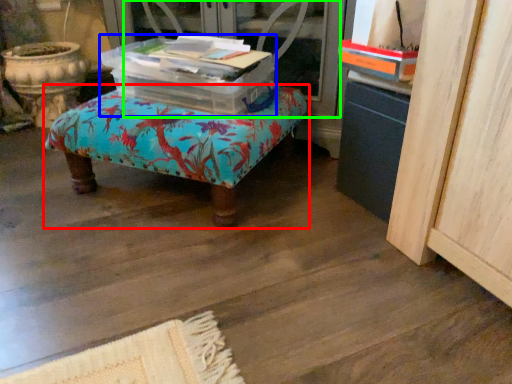
Question: Which is nearer to the furniture (highlighted by a red box)? storage box (highlighted by a blue box) or screen door (highlighted by a green box).

Choices:
 (A) storage box
 (B) screen door

Answer: (A)